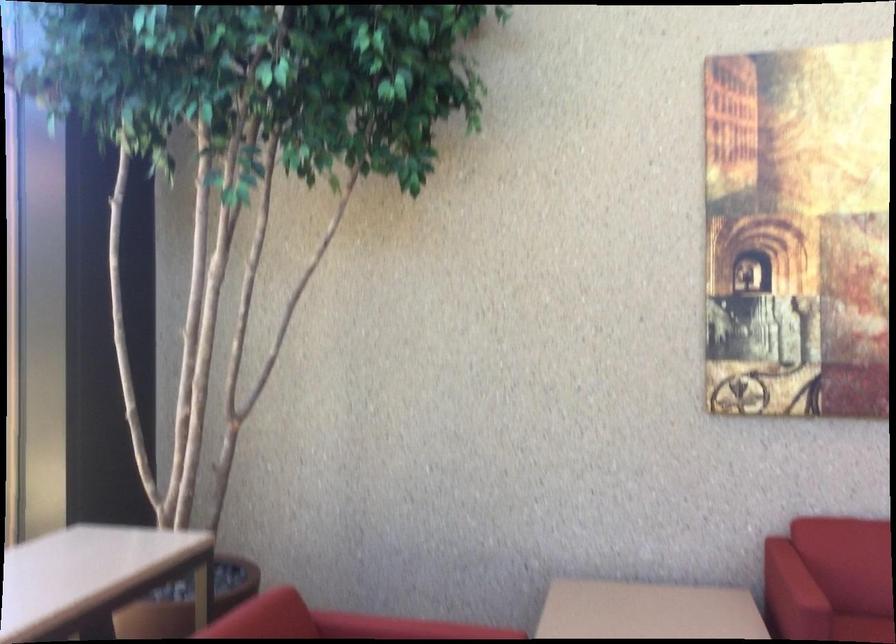
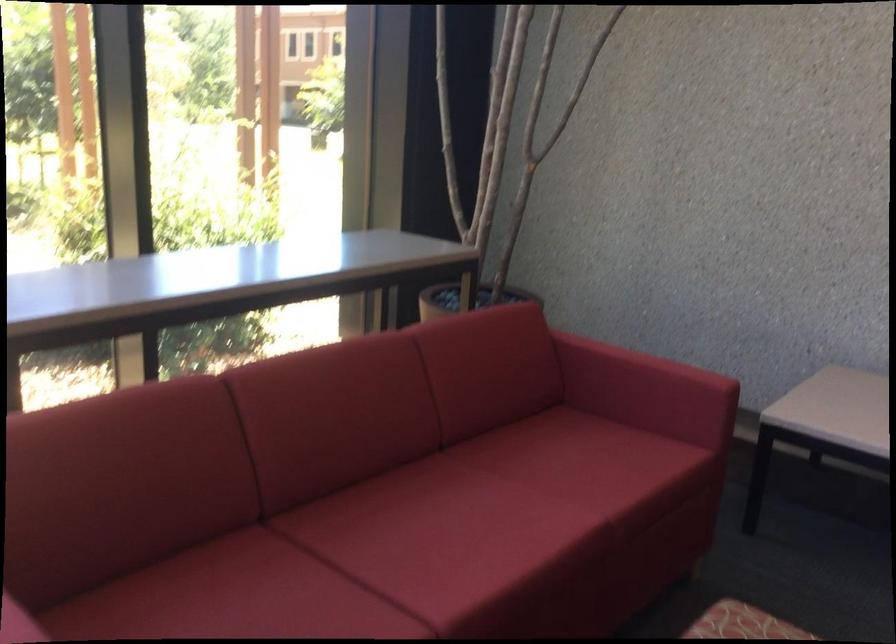
The images are taken continuously from a first-person perspective. In which direction is your viewpoint rotating?

The rotation direction of the camera is left-down.